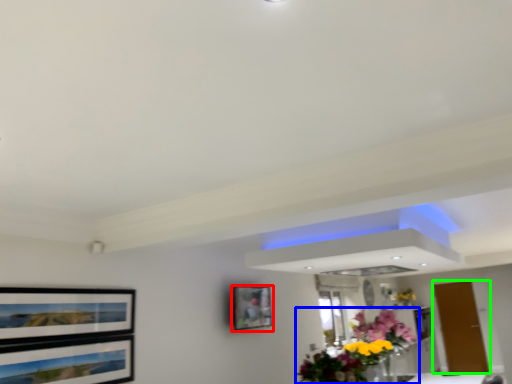
Question: Which object is positioned farthest from picture frame (highlighted by a red box)? Select from flower (highlighted by a blue box) and door (highlighted by a green box).

Choices:
 (A) flower
 (B) door

Answer: (B)